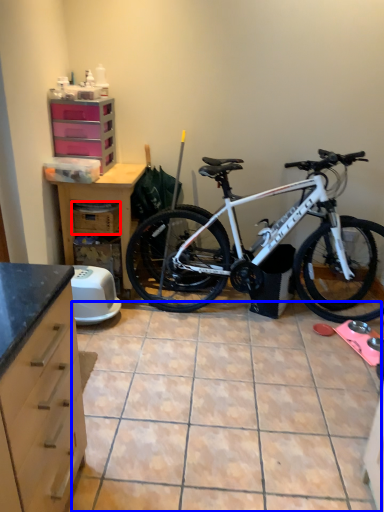
Question: Among these objects, which one is nearest to the camera, crate (highlighted by a red box) or tile (highlighted by a blue box)?

Choices:
 (A) crate
 (B) tile

Answer: (B)